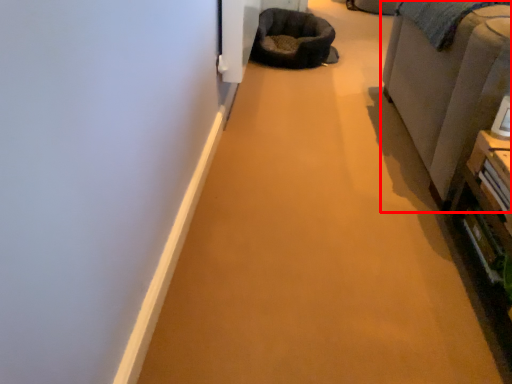
Question: From the image's perspective, where is furniture (annotated by the red box) located relative to bean bag chair?

Choices:
 (A) below
 (B) above

Answer: (A)